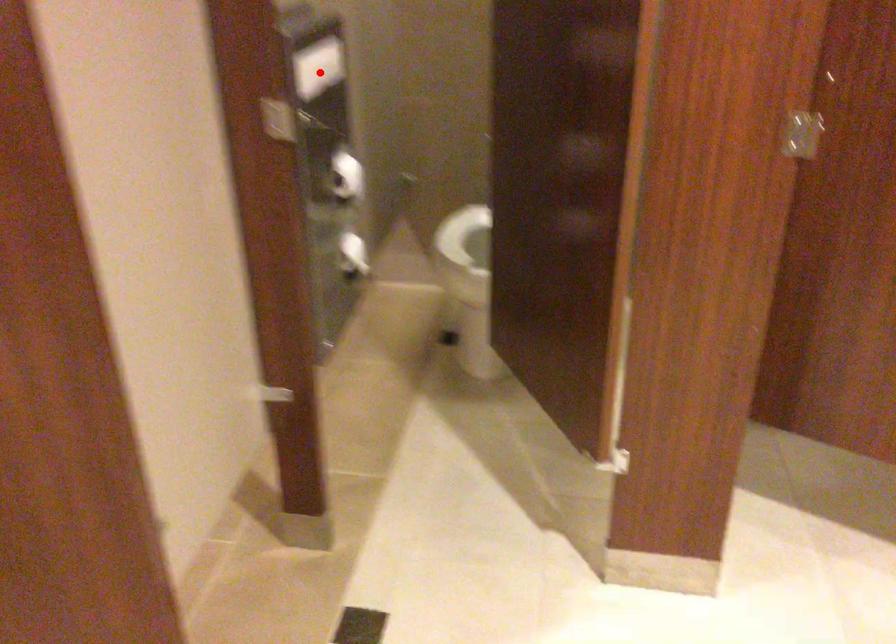
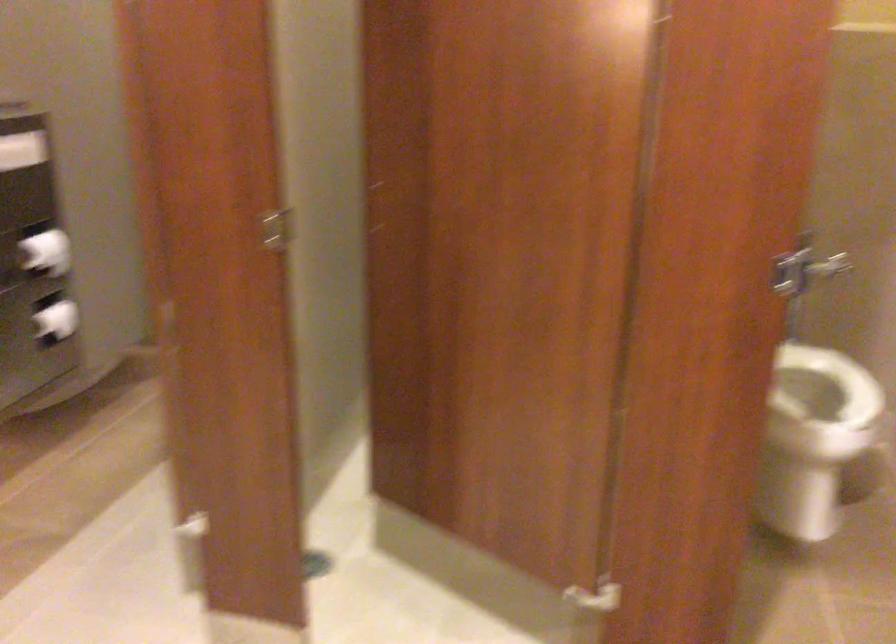
Question: A red point is marked in image1. In image2, is the corresponding 3D point closer to the camera or farther? Reply with the corresponding letter.

Choices:
 (A) The corresponding 3D point is closer.
 (B) The corresponding 3D point is farther.

Answer: (B)